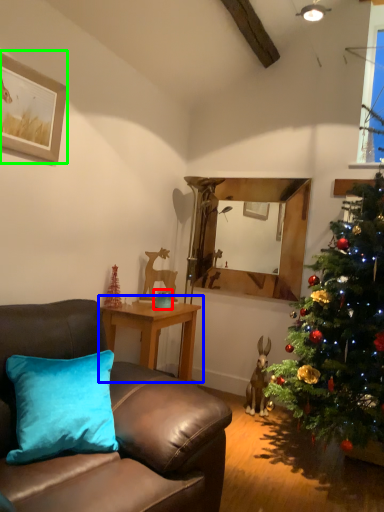
Question: Based on their relative distances, which object is farther from teal (highlighted by a red box)? Choose from table (highlighted by a blue box) and picture frame (highlighted by a green box).

Choices:
 (A) table
 (B) picture frame

Answer: (B)